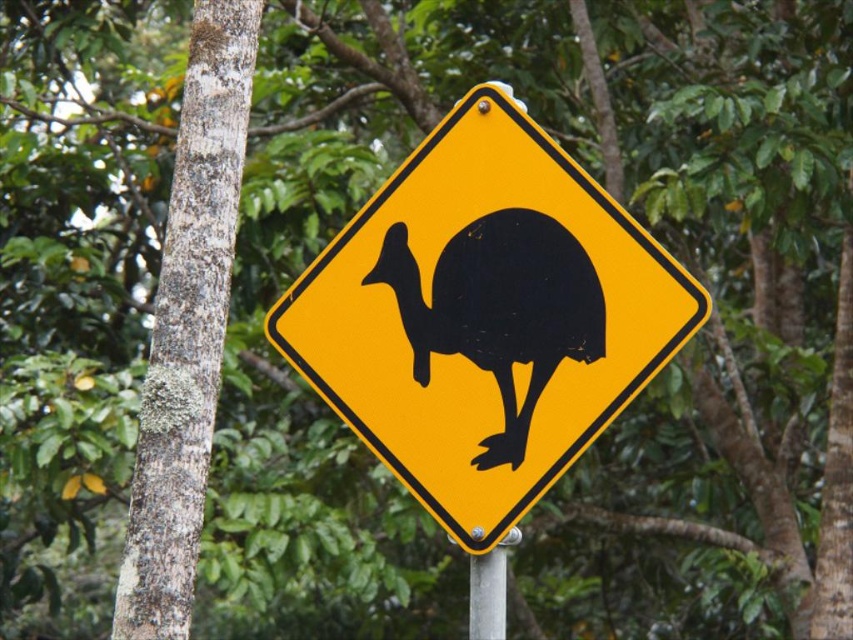
You are standing in front of the yellow kiwi bird road sign and notice two points marked on the sign. The first point is at coordinates point (432, 132) and the second is at point (549, 356). Which point is closer to you?

Point (432, 132) is further to the viewer than point (549, 356), so the point closer to you is point (549, 356).

You are a hiker trying to read the yellow plastic sign at center. There is a black glossy bird at center in your view. Can you read the sign clearly without the bird blocking your view?

The yellow plastic sign at center is in front of the black glossy bird at center, so the bird is behind the sign. Therefore, you can read the sign clearly without the bird blocking your view.

You are a hiker who wants to take a photo of the black glossy bird at center and the silver metallic pole at center. Which object should you focus on first if you want to capture both in the same frame without moving your camera?

The black glossy bird at center is to the left of the silver metallic pole at center. Since they are both centered but the bird is to the left, you should focus on the silver metallic pole at center first as it is further to the right, ensuring both are in frame without moving the camera.